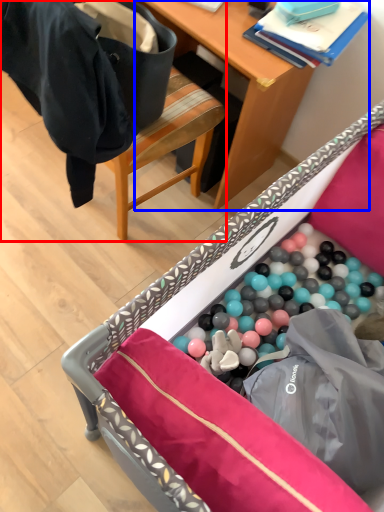
Question: Which object is closer to the camera taking this photo, chair (highlighted by a red box) or desk (highlighted by a blue box)?

Choices:
 (A) chair
 (B) desk

Answer: (A)